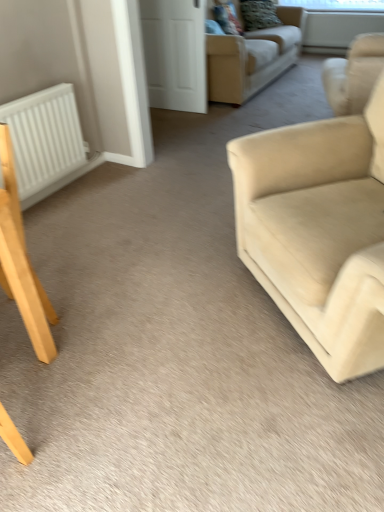
Question: Are white matte door at upper center and light brown wooden chair at lower left located far from each other?

Choices:
 (A) no
 (B) yes

Answer: (B)

Question: Is white matte door at upper center directly adjacent to light brown wooden chair at lower left?

Choices:
 (A) yes
 (B) no

Answer: (B)

Question: From the image's perspective, is white matte door at upper center above light brown wooden chair at lower left?

Choices:
 (A) no
 (B) yes

Answer: (B)

Question: Is white matte door at upper center behind light brown wooden chair at lower left?

Choices:
 (A) no
 (B) yes

Answer: (B)

Question: Is white matte door at upper center facing towards light brown wooden chair at lower left?

Choices:
 (A) yes
 (B) no

Answer: (A)

Question: Considering the relative sizes of white matte door at upper center and light brown wooden chair at lower left in the image provided, is white matte door at upper center thinner than light brown wooden chair at lower left?

Choices:
 (A) no
 (B) yes

Answer: (B)

Question: Does light brown wooden chair at lower left appear on the right side of white matte door at upper center?

Choices:
 (A) yes
 (B) no

Answer: (B)

Question: Does light brown wooden chair at lower left lie in front of white matte door at upper center?

Choices:
 (A) yes
 (B) no

Answer: (A)

Question: Is light brown wooden chair at lower left shorter than white matte door at upper center?

Choices:
 (A) yes
 (B) no

Answer: (A)

Question: Is light brown wooden chair at lower left positioned far away from white matte door at upper center?

Choices:
 (A) no
 (B) yes

Answer: (B)

Question: Considering the relative sizes of light brown wooden chair at lower left and white matte door at upper center in the image provided, is light brown wooden chair at lower left smaller than white matte door at upper center?

Choices:
 (A) yes
 (B) no

Answer: (B)

Question: Is light brown wooden chair at lower left located outside white matte door at upper center?

Choices:
 (A) no
 (B) yes

Answer: (B)

Question: Does beige fabric couch at upper center, marked as the first studio couch in a back-to-front arrangement, have a smaller size compared to transparent plastic window screen at upper center, which is the second window screen from bottom to top?

Choices:
 (A) yes
 (B) no

Answer: (B)